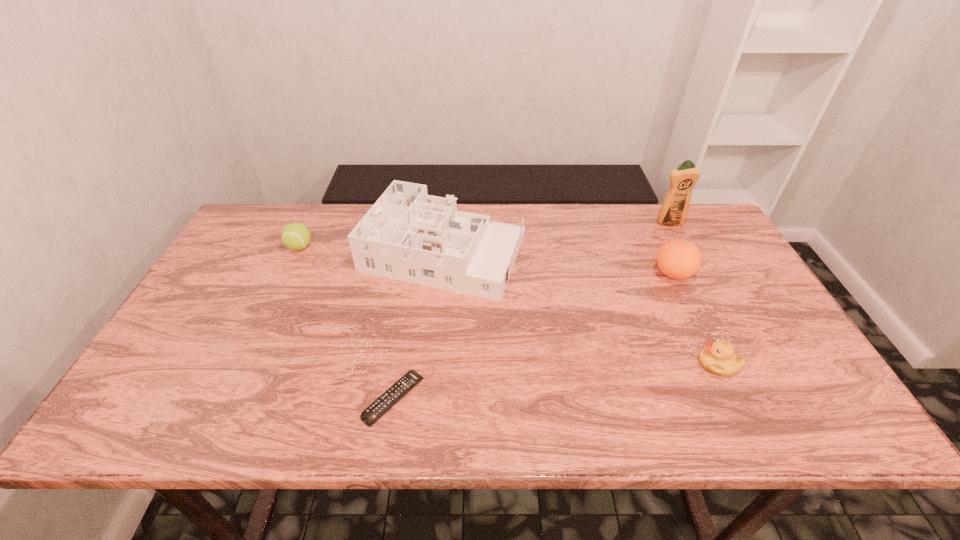
Identify the location of detergent. (674, 210).

Image resolution: width=960 pixels, height=540 pixels. What are the coordinates of `dollhouse` in the screenshot? It's located at (408, 235).

Find the location of a particular element. This screenshot has height=540, width=960. orange is located at coordinates (678, 259).

Where is `tennis ball`? This screenshot has height=540, width=960. tennis ball is located at coordinates (295, 236).

In order to click on duckling in this screenshot , I will do `click(718, 358)`.

The width and height of the screenshot is (960, 540). Find the location of `the shortest object`. the shortest object is located at coordinates (390, 397).

I want to click on vacant space located 0.290m on the label of the detergent, so click(x=705, y=291).

You are a GUI agent. You are given a task and a screenshot of the screen. Output one action in this format:
    pyautogui.click(x=<x>, y=<y>)
    Task: Click on the free space located on the left of the dollhouse
    
    Given the screenshot: What is the action you would take?
    pyautogui.click(x=316, y=252)

This screenshot has height=540, width=960. Find the location of `vacant region located 0.140m on the front of the orange`. vacant region located 0.140m on the front of the orange is located at coordinates (698, 327).

Where is `vacant space located on the right of the leftmost object`? The image size is (960, 540). vacant space located on the right of the leftmost object is located at coordinates (427, 247).